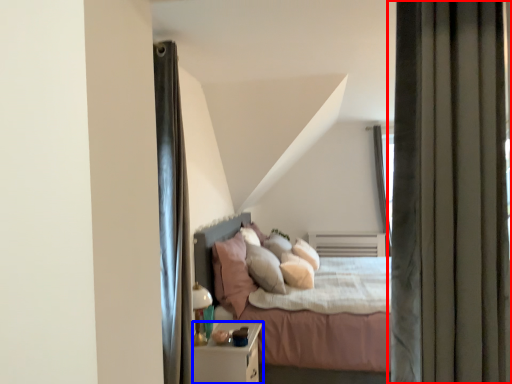
Question: Which of the following is the closest to the observer, curtain (highlighted by a red box) or nightstand (highlighted by a blue box)?

Choices:
 (A) curtain
 (B) nightstand

Answer: (A)